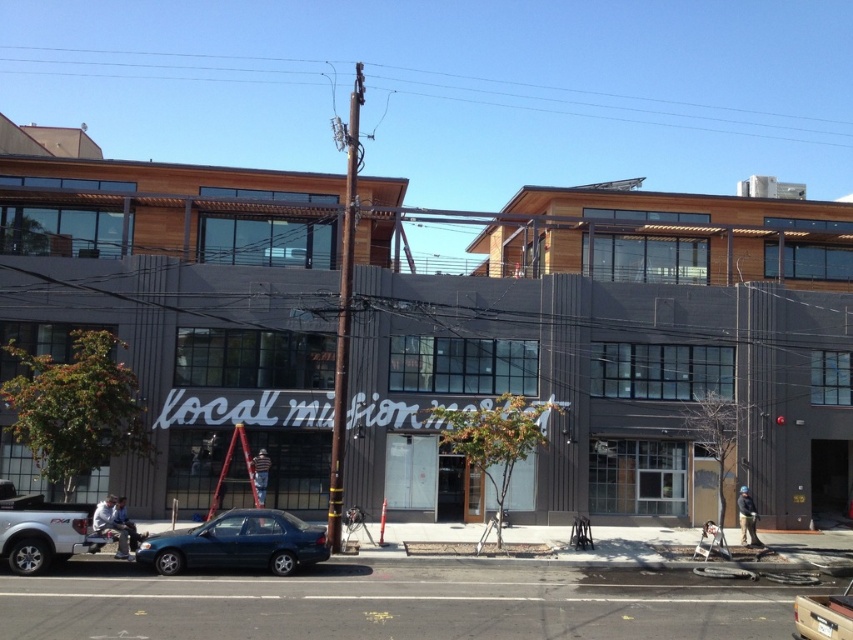
Is teal matte sedan at center bigger than metallic silver truck at center?

Actually, teal matte sedan at center might be smaller than metallic silver truck at center.

Is point (241, 540) farther from viewer compared to point (817, 596)?

Yes, point (241, 540) is farther from viewer.

Between point (233, 540) and point (799, 636), which one is positioned in front?

Point (799, 636) is in front.

Identify the location of teal matte sedan at center. The width and height of the screenshot is (853, 640). (238, 544).

Does matte black sign at center have a greater height compared to teal matte sedan at center?

Yes.

Does point (183, 349) come behind point (251, 538)?

Yes, point (183, 349) is behind point (251, 538).

Locate an element on the screen. The image size is (853, 640). matte black sign at center is located at coordinates (608, 376).

Can you confirm if matte black sign at center is shorter than metallic silver truck at center?

No, matte black sign at center is not shorter than metallic silver truck at center.

Between matte black sign at center and metallic silver truck at center, which one appears on the left side from the viewer's perspective?

From the viewer's perspective, matte black sign at center appears more on the left side.

Which is in front, point (630, 422) or point (840, 608)?

Point (840, 608) is in front.

You are a GUI agent. You are given a task and a screenshot of the screen. Output one action in this format:
    pyautogui.click(x=<x>, y=<y>)
    Task: Click on the matte black sign at center
    
    Given the screenshot: What is the action you would take?
    pyautogui.click(x=608, y=376)